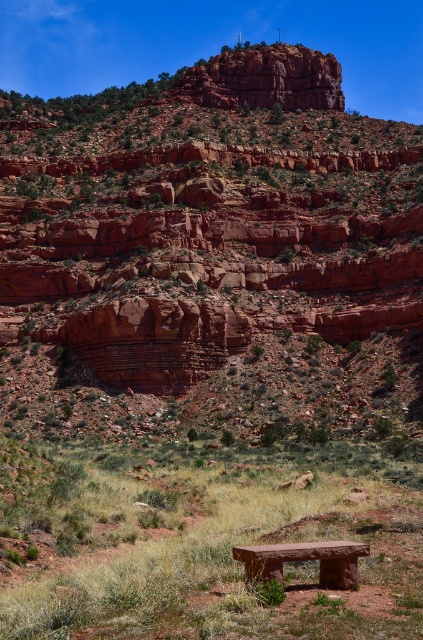
Can you confirm if brown stone bench at center is smaller than smooth stone bench at center?

No, brown stone bench at center is not smaller than smooth stone bench at center.

Which is in front, point (222, 604) or point (321, 552)?

Point (222, 604) is more forward.

At what (x,y) coordinates should I click in order to perform the action: click on brown stone bench at center. Please return your answer as a coordinate pair (x, y). Looking at the image, I should click on (202, 547).

What are the coordinates of `brown stone bench at center` in the screenshot? It's located at (202, 547).